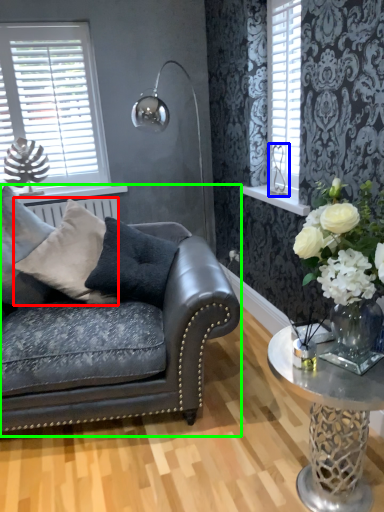
Question: Based on their relative distances, which object is farther from pillow (highlighted by a red box)? Choose from silver (highlighted by a blue box) and studio couch (highlighted by a green box).

Choices:
 (A) silver
 (B) studio couch

Answer: (A)